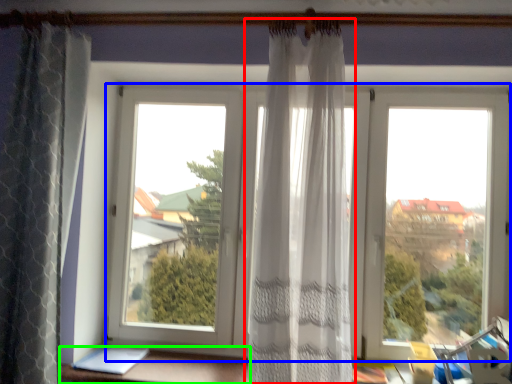
Question: Which is nearer to the curtain (highlighted by a red box)? window (highlighted by a blue box) or furniture (highlighted by a green box).

Choices:
 (A) window
 (B) furniture

Answer: (A)